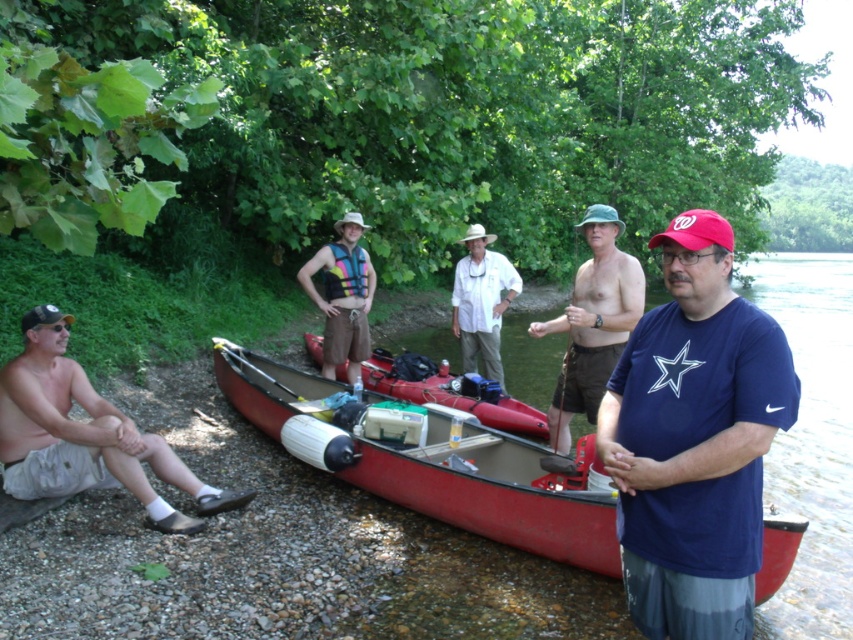
Question: Can you confirm if blue cotton t-shirt at center is positioned to the left of green fabric hat at center?

Choices:
 (A) no
 (B) yes

Answer: (B)

Question: Can you confirm if blue cotton t-shirt at center is wider than white cotton shirt at center?

Choices:
 (A) yes
 (B) no

Answer: (B)

Question: Based on their relative distances, which object is nearer to the white cotton shirt at center?

Choices:
 (A) blue cotton t-shirt at center
 (B) tan cotton shorts at lower left
 (C) rainbow life vest at center

Answer: (C)

Question: Based on their relative distances, which object is farther from the red canoe at center?

Choices:
 (A) white cotton shirt at center
 (B) yellow plastic paddle at center

Answer: (A)

Question: Which object is closer to the camera taking this photo?

Choices:
 (A) matte red canoe at center
 (B) rainbow life vest at center
 (C) red canoe at center

Answer: (C)

Question: Is rainbow life vest at center wider than matte red canoe at center?

Choices:
 (A) yes
 (B) no

Answer: (B)